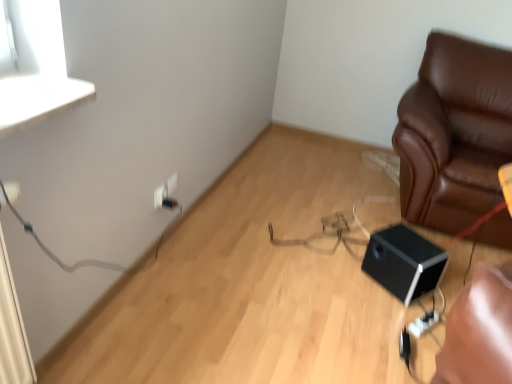
Locate an element on the screen. Image resolution: width=512 pixels, height=384 pixels. white plastic electric outlet at lower left, marked as the 3th electric outlet in a front-to-back arrangement is located at coordinates point(170,184).

Where is `black matte speaker at lower right`? The image size is (512, 384). black matte speaker at lower right is located at coordinates (404, 262).

What do you see at coordinates (160, 195) in the screenshot? I see `white plastic electric outlet at upper center, the 1th electric outlet viewed from the front` at bounding box center [160, 195].

Image resolution: width=512 pixels, height=384 pixels. Identify the location of white plastic electric outlet at lower left, which is the 1th electric outlet from back to front. (170, 184).

Based on the photo, measure the distance from white plastic electric outlet at upper center, marked as the third electric outlet in a back-to-front arrangement, to black matte speaker at lower right.

1.12 meters.

From the image's perspective, which one is positioned higher, white plastic electric outlet at upper center, marked as the third electric outlet in a back-to-front arrangement, or black matte speaker at lower right?

white plastic electric outlet at upper center, marked as the third electric outlet in a back-to-front arrangement, appears higher in the image.

Is white plastic electric outlet at upper center, marked as the third electric outlet in a back-to-front arrangement, touching black matte speaker at lower right?

No, white plastic electric outlet at upper center, marked as the third electric outlet in a back-to-front arrangement, is not beside black matte speaker at lower right.

Between white plastic electric outlet at upper center, the 1th electric outlet viewed from the front, and black matte speaker at lower right, which one has smaller width?

white plastic electric outlet at upper center, the 1th electric outlet viewed from the front.

Looking at this image, considering the relative sizes of white plastic electric outlet at lower left, which is the 1th electric outlet from back to front, and white plastic electric outlet at upper center, the 1th electric outlet viewed from the front, in the image provided, is white plastic electric outlet at lower left, which is the 1th electric outlet from back to front, taller than white plastic electric outlet at upper center, the 1th electric outlet viewed from the front,?

No, white plastic electric outlet at lower left, which is the 1th electric outlet from back to front, is not taller than white plastic electric outlet at upper center, the 1th electric outlet viewed from the front.

From the image's perspective, which is below, white plastic electric outlet at lower left, marked as the 3th electric outlet in a front-to-back arrangement, or white plastic electric outlet at upper center, marked as the third electric outlet in a back-to-front arrangement?

white plastic electric outlet at upper center, marked as the third electric outlet in a back-to-front arrangement.

Is the surface of white plastic electric outlet at lower left, marked as the 3th electric outlet in a front-to-back arrangement, in direct contact with white plastic electric outlet at upper center, marked as the third electric outlet in a back-to-front arrangement?

Yes, white plastic electric outlet at lower left, marked as the 3th electric outlet in a front-to-back arrangement, is in contact with white plastic electric outlet at upper center, marked as the third electric outlet in a back-to-front arrangement.

Does point (172, 185) come in front of point (158, 203)?

That is False.

Identify the location of furniture that appears above the black matte speaker at lower right (from the image's perspective). Image resolution: width=512 pixels, height=384 pixels. (454, 133).

Can you tell me how much brown leather couch at right and black matte speaker at lower right differ in facing direction?

The angular difference between brown leather couch at right and black matte speaker at lower right is 53.1 degrees.

Considering the sizes of brown leather couch at right and black matte speaker at lower right in the image, is brown leather couch at right taller or shorter than black matte speaker at lower right?

brown leather couch at right is taller than black matte speaker at lower right.

Is there a large distance between brown leather couch at right and black matte speaker at lower right?

No, brown leather couch at right is not far from black matte speaker at lower right.

Which of these two, white plastic electric outlet at lower left, marked as the 3th electric outlet in a front-to-back arrangement, or brown leather couch at right, is bigger?

Bigger between the two is brown leather couch at right.

Locate an element on the screen. The image size is (512, 384). furniture that appears above the white plastic electric outlet at lower left, which is the 1th electric outlet from back to front (from the image's perspective) is located at coordinates (454, 133).

Considering the points (166, 186) and (494, 233), which point is in front, point (166, 186) or point (494, 233)?

Positioned in front is point (166, 186).

Between black matte speaker at lower right and white plastic electric outlet at upper center, the 1th electric outlet viewed from the front, which one has less height?

white plastic electric outlet at upper center, the 1th electric outlet viewed from the front.

Does black matte speaker at lower right have a larger size compared to white plastic electric outlet at upper center, marked as the third electric outlet in a back-to-front arrangement?

Correct, black matte speaker at lower right is larger in size than white plastic electric outlet at upper center, marked as the third electric outlet in a back-to-front arrangement.

Which object is further away from the camera taking this photo, black matte speaker at lower right or white plastic electric outlet at upper center, marked as the third electric outlet in a back-to-front arrangement?

white plastic electric outlet at upper center, marked as the third electric outlet in a back-to-front arrangement, is further away from the camera.

Which is more to the right, black matte speaker at lower right or white plastic electric outlet at upper center, the 1th electric outlet viewed from the front?

From the viewer's perspective, black matte speaker at lower right appears more on the right side.

How far apart are black plastic electric outlet at lower left, the second electric outlet in the front-to-back sequence, and brown leather couch at right?

black plastic electric outlet at lower left, the second electric outlet in the front-to-back sequence, is 5.17 feet away from brown leather couch at right.

Considering the sizes of objects black plastic electric outlet at lower left, the 2th electric outlet when ordered from back to front, and brown leather couch at right in the image provided, who is wider, black plastic electric outlet at lower left, the 2th electric outlet when ordered from back to front, or brown leather couch at right?

brown leather couch at right is wider.

Considering the relative sizes of black plastic electric outlet at lower left, the second electric outlet in the front-to-back sequence, and brown leather couch at right in the image provided, is black plastic electric outlet at lower left, the second electric outlet in the front-to-back sequence, shorter than brown leather couch at right?

Yes, black plastic electric outlet at lower left, the second electric outlet in the front-to-back sequence, is shorter than brown leather couch at right.

From the image's perspective, which is below, black plastic electric outlet at lower left, the 2th electric outlet when ordered from back to front, or brown leather couch at right?

black plastic electric outlet at lower left, the 2th electric outlet when ordered from back to front, appears lower in the image.

Does white plastic electric outlet at upper center, the 1th electric outlet viewed from the front, have a greater height compared to black plastic electric outlet at lower left, the second electric outlet in the front-to-back sequence?

Yes, white plastic electric outlet at upper center, the 1th electric outlet viewed from the front, is taller than black plastic electric outlet at lower left, the second electric outlet in the front-to-back sequence.

In the scene shown: Looking at their sizes, would you say white plastic electric outlet at upper center, the 1th electric outlet viewed from the front, is wider or thinner than black plastic electric outlet at lower left, the 2th electric outlet when ordered from back to front?

Clearly, white plastic electric outlet at upper center, the 1th electric outlet viewed from the front, has less width compared to black plastic electric outlet at lower left, the 2th electric outlet when ordered from back to front.

Locate an element on the screen. the 1st electric outlet behind when counting from the white plastic electric outlet at upper center, the 1th electric outlet viewed from the front is located at coordinates (169, 203).

Which of these two, white plastic electric outlet at upper center, the 1th electric outlet viewed from the front, or black plastic electric outlet at lower left, the 2th electric outlet when ordered from back to front, is bigger?

With larger size is white plastic electric outlet at upper center, the 1th electric outlet viewed from the front.

At what (x,y) coordinates should I click in order to perform the action: click on electric outlet that is the 3rd one when counting leftward from the black matte speaker at lower right. Please return your answer as a coordinate pair (x, y). Looking at the image, I should click on (160, 195).

Where is `electric outlet that is the 1st one below the white plastic electric outlet at lower left, which is the 1th electric outlet from back to front (from a real-world perspective)`? electric outlet that is the 1st one below the white plastic electric outlet at lower left, which is the 1th electric outlet from back to front (from a real-world perspective) is located at coordinates (160, 195).

Estimate the real-world distances between objects in this image. Which object is further from white plastic electric outlet at upper center, the 1th electric outlet viewed from the front, black plastic electric outlet at lower left, the 2th electric outlet when ordered from back to front, or black matte speaker at lower right?

black matte speaker at lower right is further to white plastic electric outlet at upper center, the 1th electric outlet viewed from the front.

Based on their spatial positions, is black plastic electric outlet at lower left, the second electric outlet in the front-to-back sequence, or brown leather couch at right closer to black matte speaker at lower right?

The object closer to black matte speaker at lower right is brown leather couch at right.

From the image, which object appears to be farther from black plastic electric outlet at lower left, the 2th electric outlet when ordered from back to front, white plastic electric outlet at lower left, which is the 1th electric outlet from back to front, or brown leather couch at right?

The object further to black plastic electric outlet at lower left, the 2th electric outlet when ordered from back to front, is brown leather couch at right.

Looking at the image, which one is located further to brown leather couch at right, black matte speaker at lower right or black plastic electric outlet at lower left, the 2th electric outlet when ordered from back to front?

Among the two, black plastic electric outlet at lower left, the 2th electric outlet when ordered from back to front, is located further to brown leather couch at right.

Which object lies nearer to the anchor point black matte speaker at lower right, black plastic electric outlet at lower left, the second electric outlet in the front-to-back sequence, or white plastic electric outlet at lower left, marked as the 3th electric outlet in a front-to-back arrangement?

Based on the image, black plastic electric outlet at lower left, the second electric outlet in the front-to-back sequence, appears to be nearer to black matte speaker at lower right.

Which object lies further to the anchor point black matte speaker at lower right, brown leather couch at right or white plastic electric outlet at lower left, which is the 1th electric outlet from back to front?

Among the two, white plastic electric outlet at lower left, which is the 1th electric outlet from back to front, is located further to black matte speaker at lower right.

When comparing their distances from white plastic electric outlet at upper center, marked as the third electric outlet in a back-to-front arrangement, does black plastic electric outlet at lower left, the 2th electric outlet when ordered from back to front, or white plastic electric outlet at lower left, which is the 1th electric outlet from back to front, seem further?

Among the two, black plastic electric outlet at lower left, the 2th electric outlet when ordered from back to front, is located further to white plastic electric outlet at upper center, marked as the third electric outlet in a back-to-front arrangement.

Looking at the image, which one is located further to white plastic electric outlet at upper center, marked as the third electric outlet in a back-to-front arrangement, white plastic electric outlet at lower left, which is the 1th electric outlet from back to front, or brown leather couch at right?

brown leather couch at right.

Find the location of a particular element. speaker between black plastic electric outlet at lower left, the second electric outlet in the front-to-back sequence, and brown leather couch at right from left to right is located at coordinates (404, 262).

At what (x,y) coordinates should I click in order to perform the action: click on electric outlet situated between black plastic electric outlet at lower left, the 2th electric outlet when ordered from back to front, and brown leather couch at right from left to right. Please return your answer as a coordinate pair (x, y). Looking at the image, I should click on (170, 184).

Find the location of `electric outlet between white plastic electric outlet at upper center, marked as the third electric outlet in a back-to-front arrangement, and white plastic electric outlet at lower left, marked as the 3th electric outlet in a front-to-back arrangement, along the z-axis`. electric outlet between white plastic electric outlet at upper center, marked as the third electric outlet in a back-to-front arrangement, and white plastic electric outlet at lower left, marked as the 3th electric outlet in a front-to-back arrangement, along the z-axis is located at coordinates (169, 203).

This screenshot has height=384, width=512. I want to click on speaker situated between white plastic electric outlet at upper center, marked as the third electric outlet in a back-to-front arrangement, and brown leather couch at right from left to right, so click(x=404, y=262).